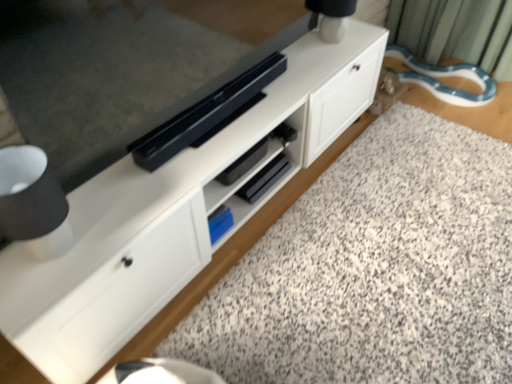
Question: Is white matte cabinet at center shorter than granite at lower center?

Choices:
 (A) no
 (B) yes

Answer: (A)

Question: From the image's perspective, is white matte cabinet at center on top of granite at lower center?

Choices:
 (A) no
 (B) yes

Answer: (B)

Question: Is the depth of white matte cabinet at center less than that of granite at lower center?

Choices:
 (A) no
 (B) yes

Answer: (A)

Question: Is white matte cabinet at center smaller than granite at lower center?

Choices:
 (A) no
 (B) yes

Answer: (A)

Question: Does white matte cabinet at center have a greater width compared to granite at lower center?

Choices:
 (A) no
 (B) yes

Answer: (A)

Question: Considering the positions of granite at lower center and white matte cabinet at center in the image, is granite at lower center wider or thinner than white matte cabinet at center?

Choices:
 (A) thin
 (B) wide

Answer: (B)

Question: From a real-world perspective, relative to white matte cabinet at center, is granite at lower center vertically above or below?

Choices:
 (A) above
 (B) below

Answer: (B)

Question: Is point (332, 357) positioned closer to the camera than point (30, 342)?

Choices:
 (A) farther
 (B) closer

Answer: (A)

Question: Is granite at lower center inside the boundaries of white matte cabinet at center, or outside?

Choices:
 (A) outside
 (B) inside

Answer: (A)

Question: Is white matte cabinet at center taller or shorter than white matte table lamp at upper right?

Choices:
 (A) short
 (B) tall

Answer: (B)

Question: Does point 87,162 appear closer or farther from the camera than point 317,1?

Choices:
 (A) closer
 (B) farther

Answer: (A)

Question: In the image, is white matte cabinet at center on the left side or the right side of white matte table lamp at upper right?

Choices:
 (A) left
 (B) right

Answer: (A)

Question: From a real-world perspective, relative to white matte table lamp at upper right, is white matte cabinet at center vertically above or below?

Choices:
 (A) above
 (B) below

Answer: (B)

Question: From a real-world perspective, relative to granite at lower center, is white matte cabinet at center vertically above or below?

Choices:
 (A) below
 (B) above

Answer: (B)

Question: In terms of height, does white matte cabinet at center look taller or shorter compared to granite at lower center?

Choices:
 (A) tall
 (B) short

Answer: (A)